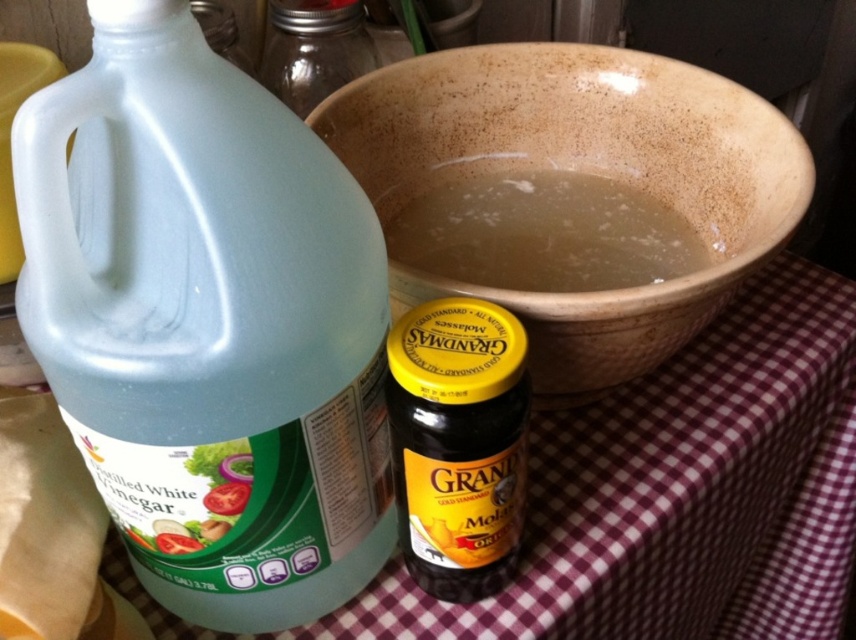
You are organizing items on a kitchen counter with a red and white checkered tablecloth. You have a large plastic jug of distilled white vinegar on the left and a small glass jar of molasses on the right. There is also a point marked at coordinates (458, 444). What item is located at the marked point?

The point at coordinates (458, 444) marks the yellow golden plastic jar at center.

From the picture: You are organizing items on a kitchen countertop with a red and white checkered tablecloth. You need to place a new item exactly at the coordinates point 0.6, 0.25. Is there enough space between the translucent plastic bottle at left and the edge of the tablecloth to place it there?

The translucent plastic bottle at left is located at point [207,323]. Since the new item is to be placed at [214,384], which is slightly to the right and slightly above the bottle, there should be enough space between the bottle and the edge of the tablecloth to place the new item there.